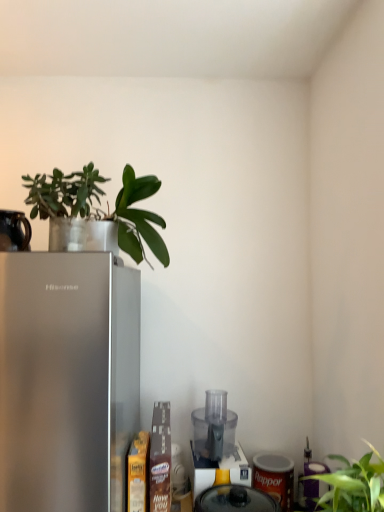
Question: Should I look upward or downward to see transparent plastic food processor at lower center, arranged as the second appliance when viewed from the left?

Choices:
 (A) up
 (B) down

Answer: (B)

Question: Does transparent plastic blender at center have a greater width compared to green matte leafy plant at upper left, which is the first plant in right-to-left order?

Choices:
 (A) no
 (B) yes

Answer: (B)

Question: Is transparent plastic blender at center outside of green matte leafy plant at upper left, which is the first plant in right-to-left order?

Choices:
 (A) no
 (B) yes

Answer: (B)

Question: From the image's perspective, is transparent plastic blender at center beneath green matte leafy plant at upper left, the 2th plant viewed from the left?

Choices:
 (A) no
 (B) yes

Answer: (B)

Question: Considering the relative positions of transparent plastic blender at center and green matte leafy plant at upper left, which is the first plant in right-to-left order, in the image provided, is transparent plastic blender at center to the left of green matte leafy plant at upper left, which is the first plant in right-to-left order, from the viewer's perspective?

Choices:
 (A) no
 (B) yes

Answer: (A)

Question: Does transparent plastic blender at center lie in front of green matte leafy plant at upper left, which is the first plant in right-to-left order?

Choices:
 (A) no
 (B) yes

Answer: (A)

Question: Is transparent plastic blender at center far away from green matte leafy plant at upper left, the 2th plant viewed from the left?

Choices:
 (A) no
 (B) yes

Answer: (A)

Question: From the image's perspective, would you say satin silver refrigerator at left is positioned over green matte leafy plant at upper left, which is the first plant in right-to-left order?

Choices:
 (A) no
 (B) yes

Answer: (A)

Question: Is green matte leafy plant at upper left, which is the first plant in right-to-left order, at the back of satin silver refrigerator at left?

Choices:
 (A) yes
 (B) no

Answer: (B)

Question: Would you say satin silver refrigerator at left is outside green matte leafy plant at upper left, which is the first plant in right-to-left order?

Choices:
 (A) yes
 (B) no

Answer: (A)

Question: Is satin silver refrigerator at left taller than green matte leafy plant at upper left, which is the first plant in right-to-left order?

Choices:
 (A) no
 (B) yes

Answer: (B)

Question: Is satin silver refrigerator at left to the left of green matte leafy plant at upper left, which is the first plant in right-to-left order, from the viewer's perspective?

Choices:
 (A) yes
 (B) no

Answer: (A)

Question: Is satin silver refrigerator at left next to green matte leafy plant at upper left, the 2th plant viewed from the left?

Choices:
 (A) no
 (B) yes

Answer: (A)

Question: From the image's perspective, is translucent plastic food processor at center, the first appliance when ordered from right to left, below transparent plastic blender at center?

Choices:
 (A) yes
 (B) no

Answer: (B)